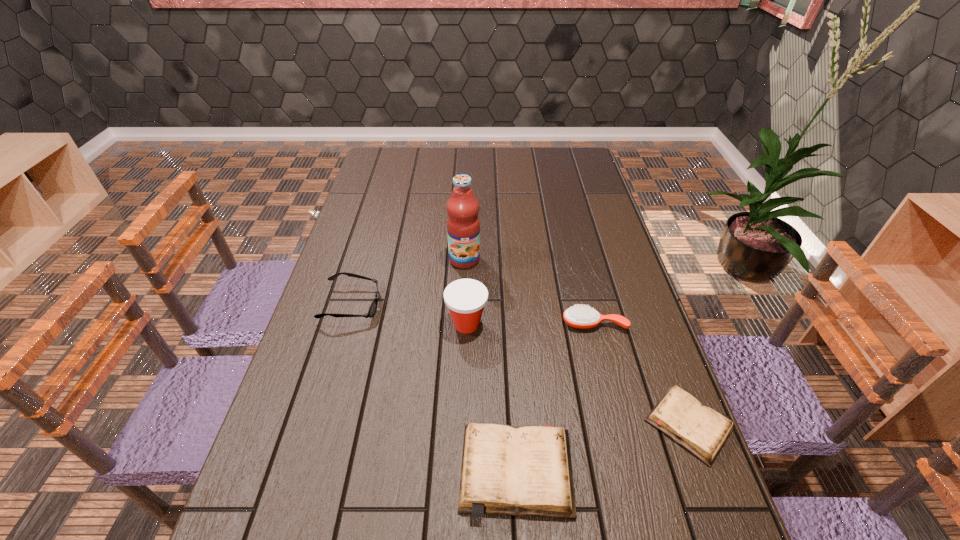
Locate an element on the screen. The image size is (960, 540). free spot located 0.210m on the left of the right diary is located at coordinates (551, 425).

I want to click on free spot located 0.080m on the front label of the tallest object, so click(x=464, y=288).

Where is `vacant space located 0.380m on the lenses of the leftmost object`? This screenshot has width=960, height=540. vacant space located 0.380m on the lenses of the leftmost object is located at coordinates (515, 305).

Image resolution: width=960 pixels, height=540 pixels. Identify the location of free space located on the back of the second tallest object. (468, 250).

Locate an element on the screen. This screenshot has height=540, width=960. free location located 0.250m on the left of the hairbrush is located at coordinates (470, 323).

You are a GUI agent. You are given a task and a screenshot of the screen. Output one action in this format:
    pyautogui.click(x=<x>, y=<y>)
    Task: Click on the object at the near edge
    This screenshot has height=540, width=960.
    Given the screenshot: What is the action you would take?
    pyautogui.click(x=520, y=471)

Identify the location of object located in the left edge section of the desktop. (373, 307).

What are the coordinates of `diary at the right edge` in the screenshot? It's located at (701, 430).

Locate an element on the screen. Image resolution: width=960 pixels, height=540 pixels. hairbrush that is positioned at the right edge is located at coordinates (578, 316).

I want to click on vacant area at the far edge of the desktop, so 542,174.